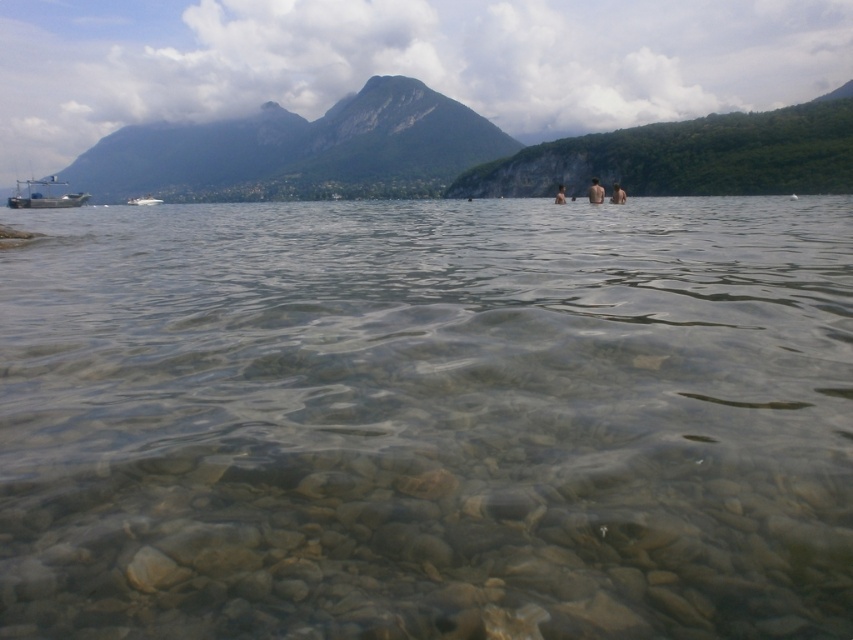
You are standing on the lakeshore and see the green rock mountain at upper center and the skinny person at center. Which object is positioned to the left of the other?

The green rock mountain at upper center is positioned to the left of the skinny person at center.

You are standing on the shore of the lake and want to take a photo of the metallic gray boat at left and the skinny person at upper center. Which object will appear larger in the photo?

The metallic gray boat at left will appear larger in the photo because it is positioned closer to the camera than the skinny person at upper center.

You are planning to take a photo of the white glossy boat at left and the skinny person at center from the shore. Which object should you focus on first if you want to capture both in the same frame without moving the camera?

You should focus on the white glossy boat at left first because it is larger in size than the skinny person at center, so it will be easier to frame properly.